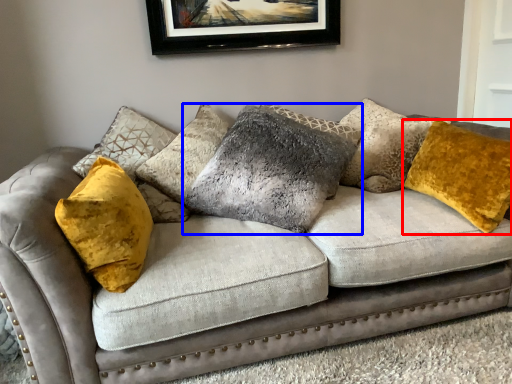
Question: Which object appears farthest to the camera in this image, pillow (highlighted by a red box) or pillow (highlighted by a blue box)?

Choices:
 (A) pillow
 (B) pillow

Answer: (B)